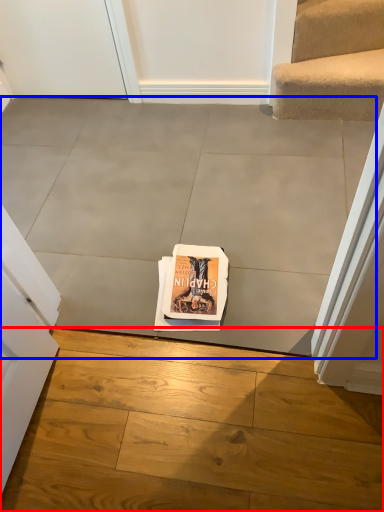
Question: Which of the following is the closest to the observer, concrete (highlighted by a red box) or concrete (highlighted by a blue box)?

Choices:
 (A) concrete
 (B) concrete

Answer: (A)